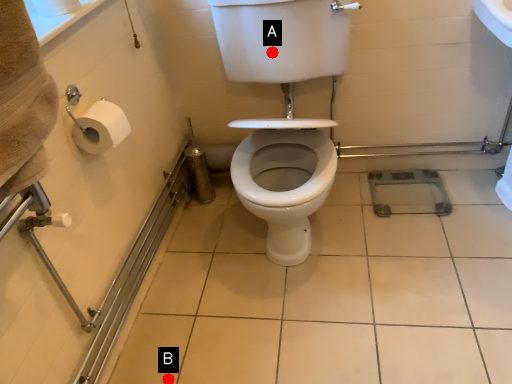
Question: Two points are circled on the image, labeled by A and B beside each circle. Which point is farther from the camera taking this photo?

Choices:
 (A) A is further
 (B) B is further

Answer: (A)